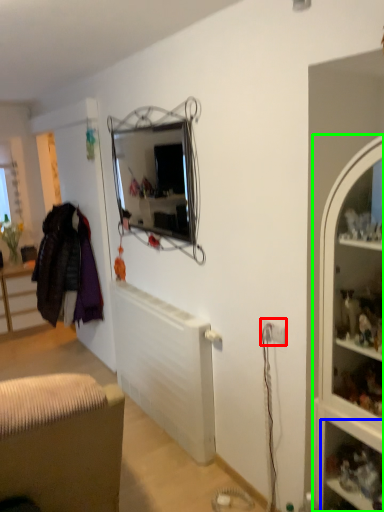
Question: Considering the real-world distances, which object is farthest from electric outlet (highlighted by a red box)? shelf (highlighted by a blue box) or cabinet (highlighted by a green box)?

Choices:
 (A) shelf
 (B) cabinet

Answer: (A)